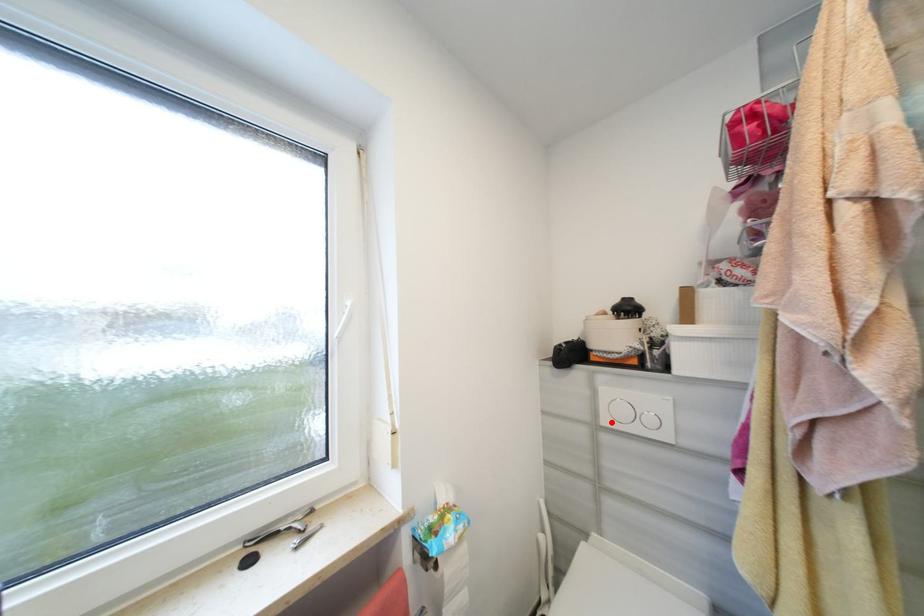
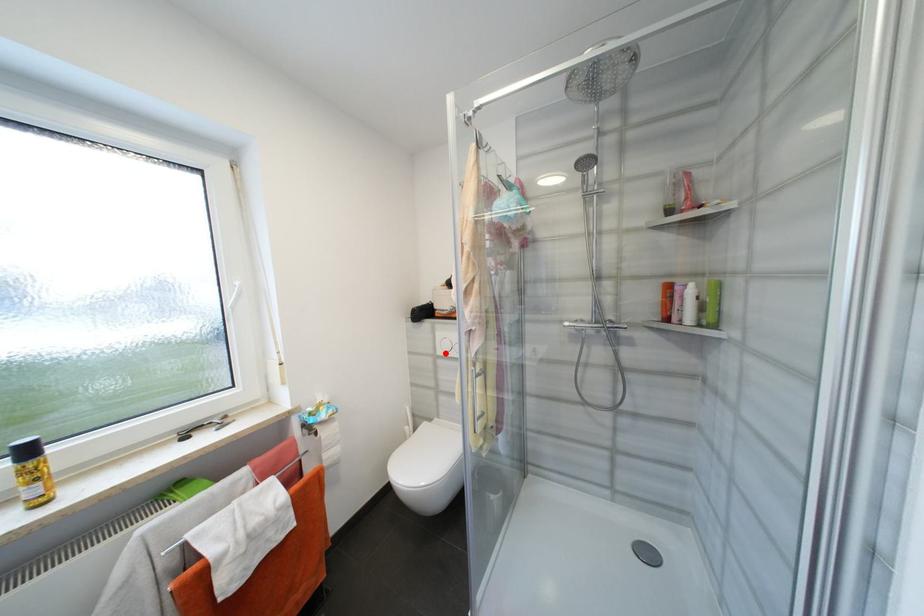
I am providing you with two images of the same scene from different viewpoints. A red point is marked on the first image and another point is marked on the second image. Do the highlighted points in image1 and image2 indicate the same real-world spot?

Yes